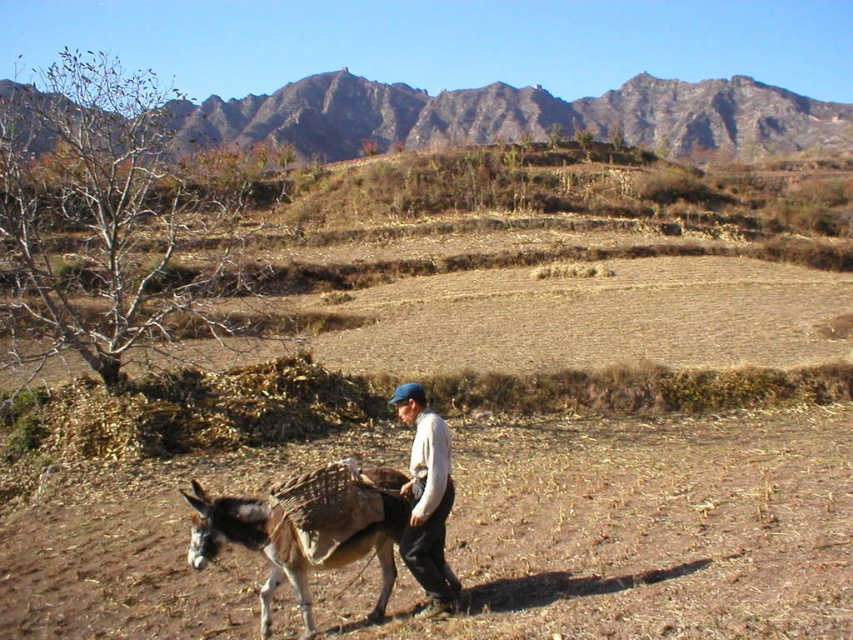
Is point (328, 547) closer to camera compared to point (450, 497)?

Yes, it is in front of point (450, 497).

Between point (380, 544) and point (408, 467), which one is positioned behind?

Positioned behind is point (408, 467).

Is point (236, 513) positioned after point (422, 538)?

That is False.

Where is `brown textured donkey at lower left`? The height and width of the screenshot is (640, 853). brown textured donkey at lower left is located at coordinates (306, 529).

Between brown grassy hillside at upper center and brown textured donkey at lower left, which one appears on the left side from the viewer's perspective?

Positioned to the left is brown textured donkey at lower left.

Find the location of `brown grassy hillside at upper center`. brown grassy hillside at upper center is located at coordinates (514, 116).

Find the location of a particular element. The image size is (853, 640). brown grassy hillside at upper center is located at coordinates (514, 116).

Is brown grassy hillside at upper center thinner than white cotton shirt at center?

Incorrect, brown grassy hillside at upper center's width is not less than white cotton shirt at center's.

Is brown grassy hillside at upper center closer to the viewer compared to white cotton shirt at center?

No, brown grassy hillside at upper center is further to the viewer.

Find the location of a particular element. The width and height of the screenshot is (853, 640). brown grassy hillside at upper center is located at coordinates (514, 116).